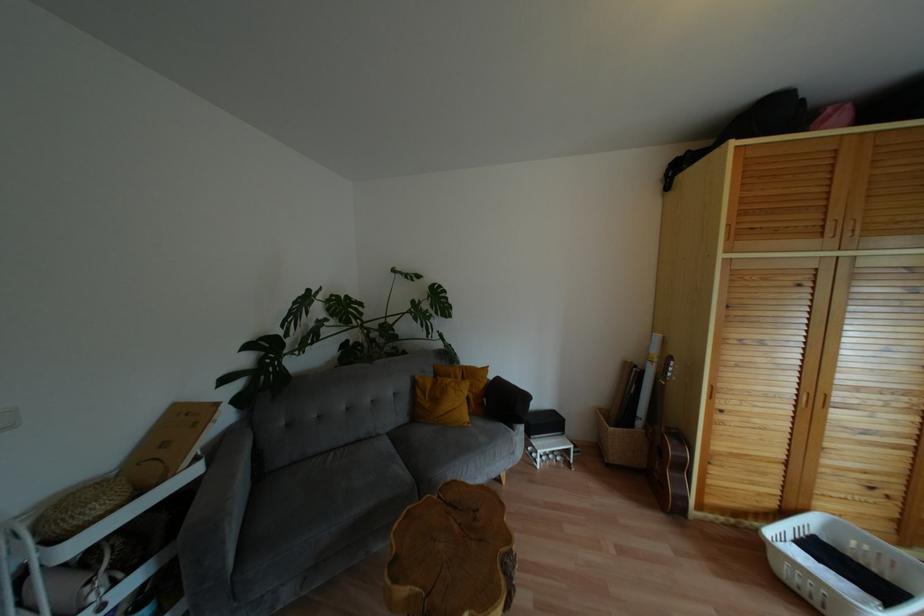
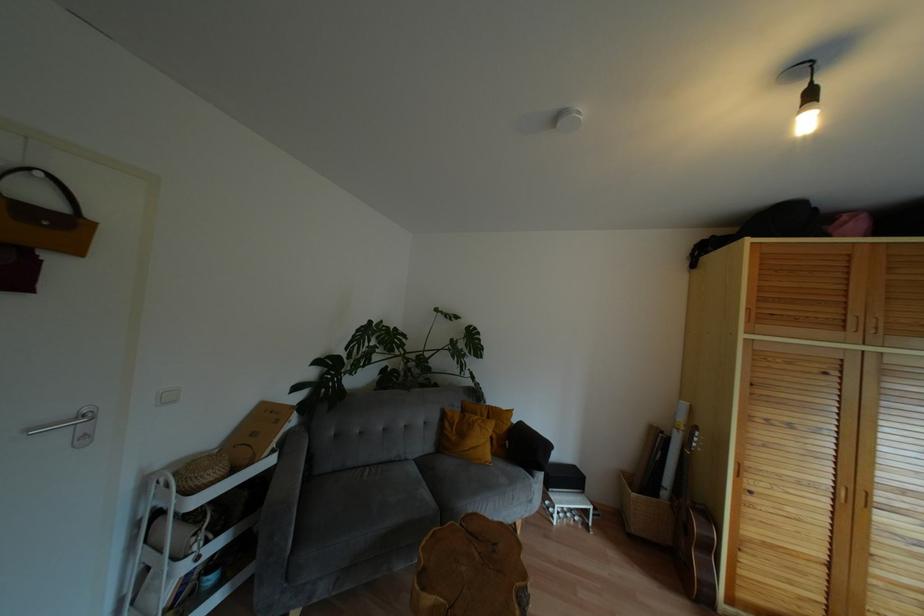
In the second image, find the point that corresponds to [613,456] in the first image.

(636, 527)